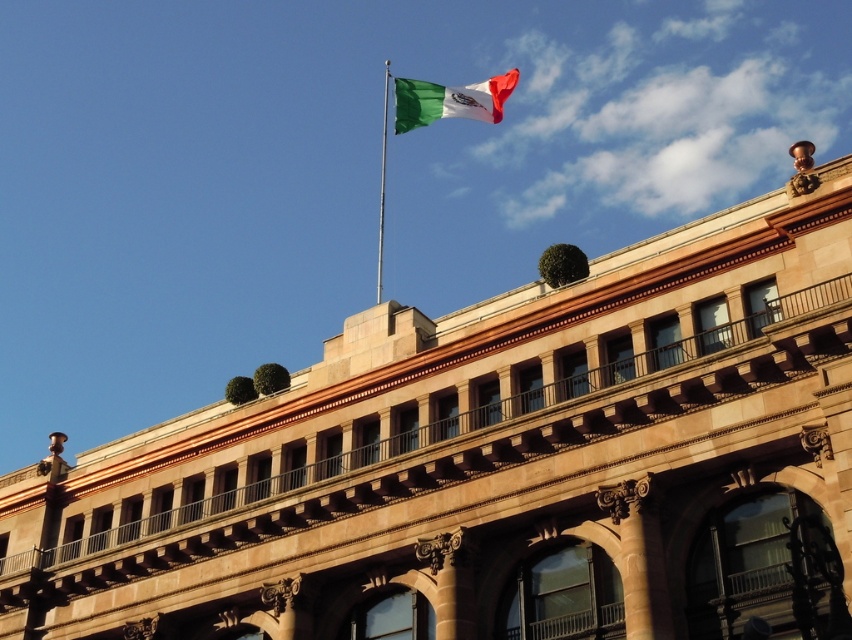
Question: Can you confirm if green and white fabric flag at upper center is smaller than silver metallic flag pole at upper center?

Choices:
 (A) yes
 (B) no

Answer: (B)

Question: Is metallic pole at upper center to the right of silver metallic flag pole at upper center from the viewer's perspective?

Choices:
 (A) yes
 (B) no

Answer: (A)

Question: Does green and white fabric flag at upper center have a smaller size compared to metallic pole at upper center?

Choices:
 (A) no
 (B) yes

Answer: (A)

Question: Which object is positioned closest to the silver metallic flag pole at upper center?

Choices:
 (A) green and white fabric flag at upper center
 (B) metallic pole at upper center

Answer: (B)

Question: Which point is closer to the camera?

Choices:
 (A) silver metallic flag pole at upper center
 (B) metallic pole at upper center
 (C) green and white fabric flag at upper center

Answer: (C)

Question: Which point is farther from the camera taking this photo?

Choices:
 (A) (389, 92)
 (B) (378, 268)
 (C) (412, 118)

Answer: (B)